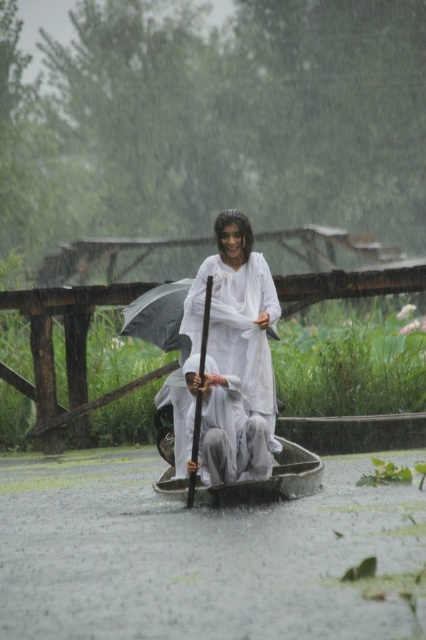
The image size is (426, 640). What do you see at coordinates (238, 312) in the screenshot?
I see `white matte cloth at center` at bounding box center [238, 312].

Is point (265, 371) positioned before point (175, 292)?

Yes.

Image resolution: width=426 pixels, height=640 pixels. In order to click on white matte cloth at center in this screenshot , I will do `click(238, 312)`.

Which of these two, white matte cloth at center or white cotton man at center, stands taller?

white matte cloth at center is taller.

Is point (238, 324) behind point (259, 429)?

Yes.

This screenshot has height=640, width=426. What do you see at coordinates (238, 312) in the screenshot?
I see `white matte cloth at center` at bounding box center [238, 312].

Where is `white matte cloth at center`? Image resolution: width=426 pixels, height=640 pixels. white matte cloth at center is located at coordinates (238, 312).

Between white cotton man at center and transparent nylon umbrella at center, which one is positioned lower?

white cotton man at center is below.

Which of these two, white cotton man at center or transparent nylon umbrella at center, stands shorter?

transparent nylon umbrella at center

Which is behind, point (238, 454) or point (169, 317)?

The point (169, 317) is more distant.

Identify the location of white cotton man at center. The image size is (426, 640). [x=224, y=428].